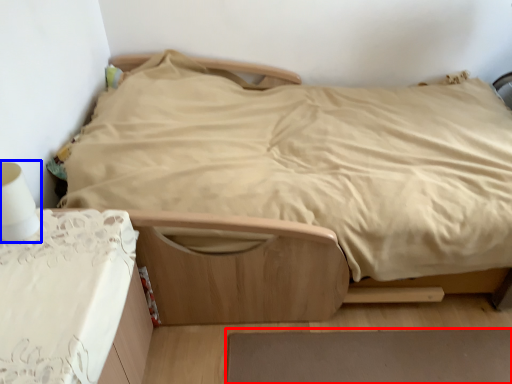
Question: Which object is closer to the camera taking this photo, plain (highlighted by a red box) or table lamp (highlighted by a blue box)?

Choices:
 (A) plain
 (B) table lamp

Answer: (B)